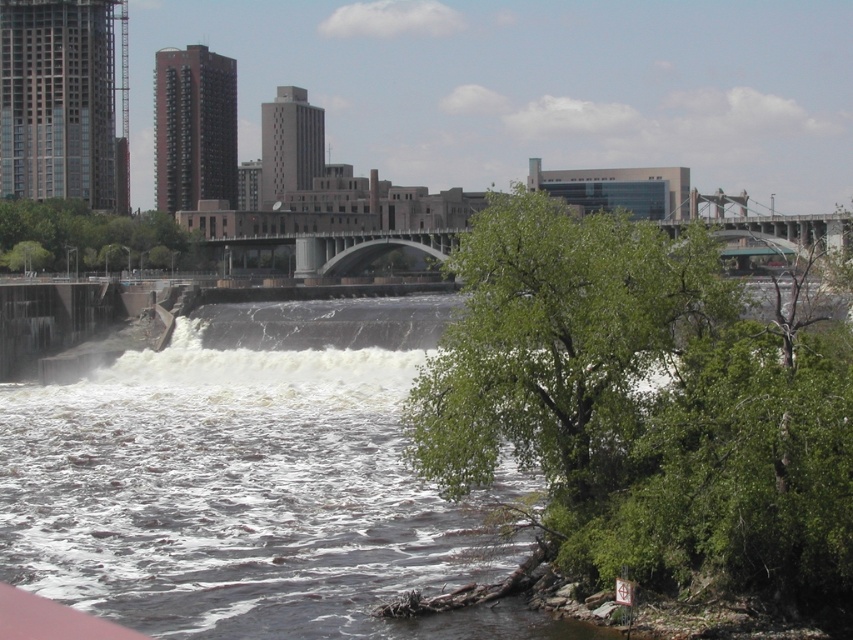
Question: Does green leafy tree at lower right appear over green leafy tree at upper center?

Choices:
 (A) yes
 (B) no

Answer: (B)

Question: Can you confirm if green leafy tree at lower right is positioned to the right of white frothy water at center?

Choices:
 (A) yes
 (B) no

Answer: (A)

Question: Among these objects, which one is nearest to the camera?

Choices:
 (A) white frothy water at center
 (B) green leafy tree at upper center

Answer: (A)

Question: Based on their relative distances, which object is nearer to the green leafy tree at upper center?

Choices:
 (A) green leafy tree at lower right
 (B) white frothy water at center

Answer: (B)

Question: Which of the following is the closest to the observer?

Choices:
 (A) (701, 481)
 (B) (15, 244)

Answer: (A)

Question: Does green leafy tree at lower right lie behind white frothy water at center?

Choices:
 (A) yes
 (B) no

Answer: (B)